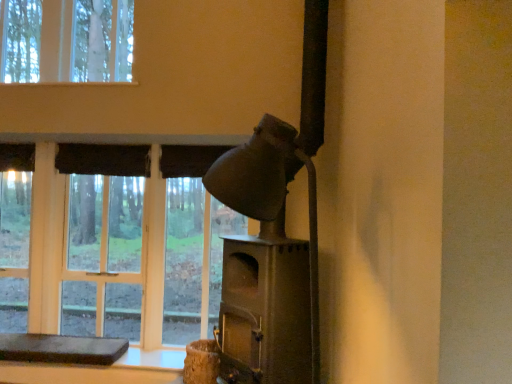
Question: Is brown leather cushion at lower left in front of or behind matte gray fireplace at center-right in the image?

Choices:
 (A) front
 (B) behind

Answer: (B)

Question: From the image's perspective, is brown leather cushion at lower left above or below matte gray fireplace at center-right?

Choices:
 (A) below
 (B) above

Answer: (A)

Question: Estimate the real-world distances between objects in this image. Which object is closer to the brown leather cushion at lower left?

Choices:
 (A) matte gray fireplace at center-right
 (B) matte glass window at center

Answer: (B)

Question: Which is nearer to the brown leather cushion at lower left?

Choices:
 (A) matte glass window at center
 (B) matte gray fireplace at center-right

Answer: (A)